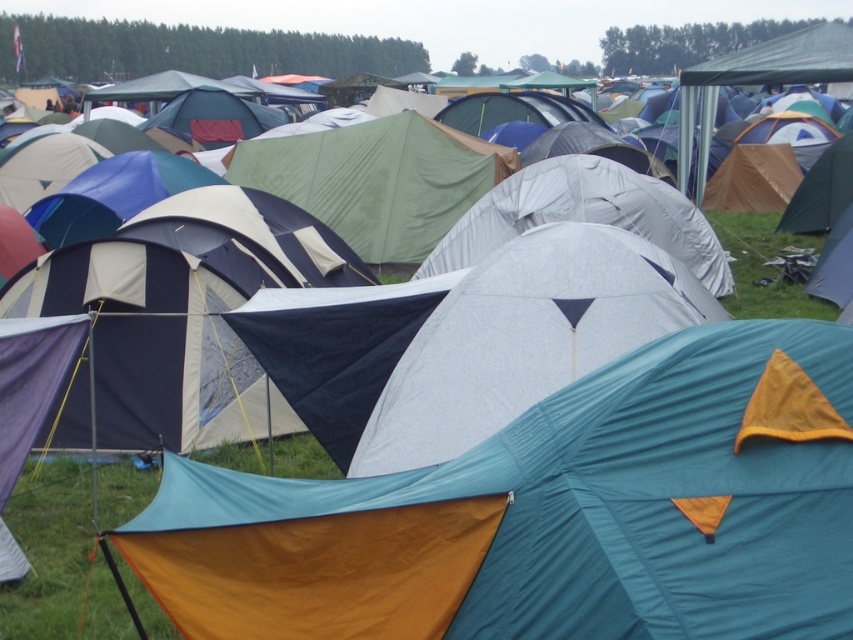
You are a festival attendee standing at the edge of the field. You see the teal fabric tent at center and the green grass at lower right. Which object is positioned lower in the image?

The teal fabric tent at center is located below green grass at lower right, so it is positioned lower in the image.

In the scene shown: You are a hiker who needs to set up a campsite. You have a tent that requires a minimum of 5 meters of space between it and any nearby vegetation to avoid moisture issues. You see the teal fabric tent at center and the green grass at lower right. Can you safely place your tent between them?

The teal fabric tent at center and green grass at lower right are 6.47 meters apart. Since the required minimum space is 5 meters, the distance is sufficient. You can safely place your tent between them as the distance meets the requirement.